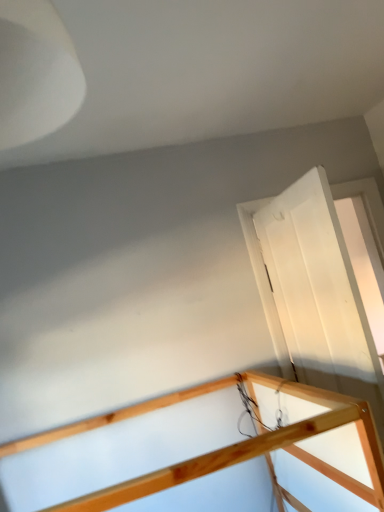
What are the coordinates of `natural wood rail at upper right` in the screenshot? It's located at (206, 454).

What do you see at coordinates (206, 454) in the screenshot? I see `natural wood rail at upper right` at bounding box center [206, 454].

Measure the distance between point (294, 185) and camera.

The depth of point (294, 185) is 6.44 feet.

This screenshot has width=384, height=512. What do you see at coordinates (313, 293) in the screenshot? I see `white glossy door at right` at bounding box center [313, 293].

At what (x,y) coordinates should I click in order to perform the action: click on white glossy door at right. Please return your answer as a coordinate pair (x, y). This screenshot has width=384, height=512. Looking at the image, I should click on (313, 293).

Identify the location of natural wood rail at upper right. (206, 454).

Does white glossy door at right appear on the right side of natural wood rail at upper right?

Correct, you'll find white glossy door at right to the right of natural wood rail at upper right.

Is white glossy door at right positioned before natural wood rail at upper right?

No, white glossy door at right is further to the viewer.

Is point (272, 295) closer to camera compared to point (97, 432)?

No, it is behind (97, 432).

From the image's perspective, which is above, white glossy door at right or natural wood rail at upper right?

white glossy door at right, from the image's perspective.

From a real-world perspective, is white glossy door at right above or below natural wood rail at upper right?

white glossy door at right is above natural wood rail at upper right.

Considering the sizes of white glossy door at right and natural wood rail at upper right in the image, is white glossy door at right wider or thinner than natural wood rail at upper right?

white glossy door at right is thinner than natural wood rail at upper right.

Can you confirm if white glossy door at right is shorter than natural wood rail at upper right?

No.

Considering the sizes of white glossy door at right and natural wood rail at upper right in the image, is white glossy door at right bigger or smaller than natural wood rail at upper right?

Clearly, white glossy door at right is smaller in size than natural wood rail at upper right.

Looking at this image, is white glossy door at right inside or outside of natural wood rail at upper right?

white glossy door at right is spatially situated outside natural wood rail at upper right.

Based on the photo, are white glossy door at right and natural wood rail at upper right located far from each other?

No, white glossy door at right is not far away from natural wood rail at upper right.

Could you tell me if white glossy door at right is turned towards natural wood rail at upper right?

No.

Locate an element on the screen. The height and width of the screenshot is (512, 384). glass door behind the natural wood rail at upper right is located at coordinates (313, 293).

In the scene shown: Considering the relative positions of natural wood rail at upper right and white glossy door at right in the image provided, is natural wood rail at upper right to the left of white glossy door at right from the viewer's perspective?

Yes.

Is natural wood rail at upper right in front of or behind white glossy door at right in the image?

Clearly, natural wood rail at upper right is in front of white glossy door at right.

Which is in front, point (175, 485) or point (350, 365)?

The point (175, 485) is in front.

From the image's perspective, which is below, natural wood rail at upper right or white glossy door at right?

From the image's view, natural wood rail at upper right is below.

From the picture: From a real-world perspective, which is physically above, natural wood rail at upper right or white glossy door at right?

white glossy door at right.

Considering the relative sizes of natural wood rail at upper right and white glossy door at right in the image provided, is natural wood rail at upper right wider than white glossy door at right?

Indeed, natural wood rail at upper right has a greater width compared to white glossy door at right.

Does natural wood rail at upper right have a lesser height compared to white glossy door at right?

Correct, natural wood rail at upper right is not as tall as white glossy door at right.

Considering the relative sizes of natural wood rail at upper right and white glossy door at right in the image provided, is natural wood rail at upper right smaller than white glossy door at right?

Actually, natural wood rail at upper right might be larger than white glossy door at right.

Do you think natural wood rail at upper right is within white glossy door at right, or outside of it?

natural wood rail at upper right lies outside white glossy door at right.

Does natural wood rail at upper right touch white glossy door at right?

There is a gap between natural wood rail at upper right and white glossy door at right.

Does natural wood rail at upper right turn towards white glossy door at right?

No, natural wood rail at upper right is not aimed at white glossy door at right.

How many degrees apart are the facing directions of natural wood rail at upper right and white glossy door at right?

The angle between the facing direction of natural wood rail at upper right and the facing direction of white glossy door at right is 93.2 degrees.

Measure the distance between natural wood rail at upper right and white glossy door at right.

They are 20.39 inches apart.

The width and height of the screenshot is (384, 512). What are the coordinates of `glass door positioned vertically above the natural wood rail at upper right (from a real-world perspective)` in the screenshot? It's located at (313, 293).

This screenshot has width=384, height=512. I want to click on glass door above the natural wood rail at upper right (from the image's perspective), so click(x=313, y=293).

At what (x,y) coordinates should I click in order to perform the action: click on rail that appears in front of the white glossy door at right. Please return your answer as a coordinate pair (x, y). Image resolution: width=384 pixels, height=512 pixels. Looking at the image, I should click on (206, 454).